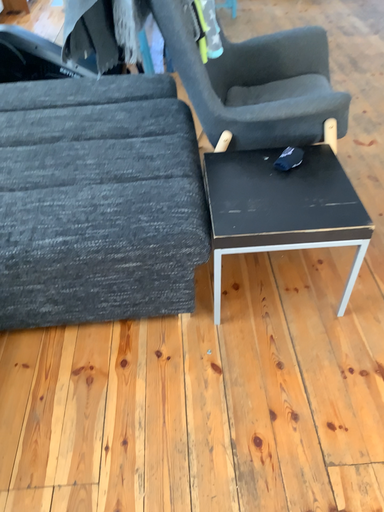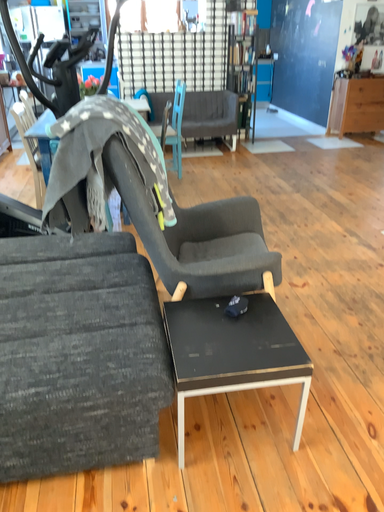
Question: How did the camera likely rotate when shooting the video?

Choices:
 (A) rotated upward
 (B) rotated downward

Answer: (A)